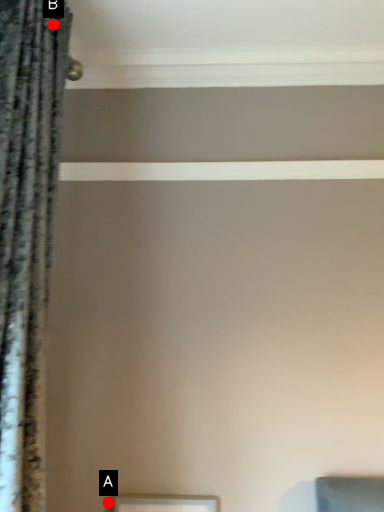
Question: Two points are circled on the image, labeled by A and B beside each circle. Among these points, which one is farthest from the camera?

Choices:
 (A) A is further
 (B) B is further

Answer: (A)